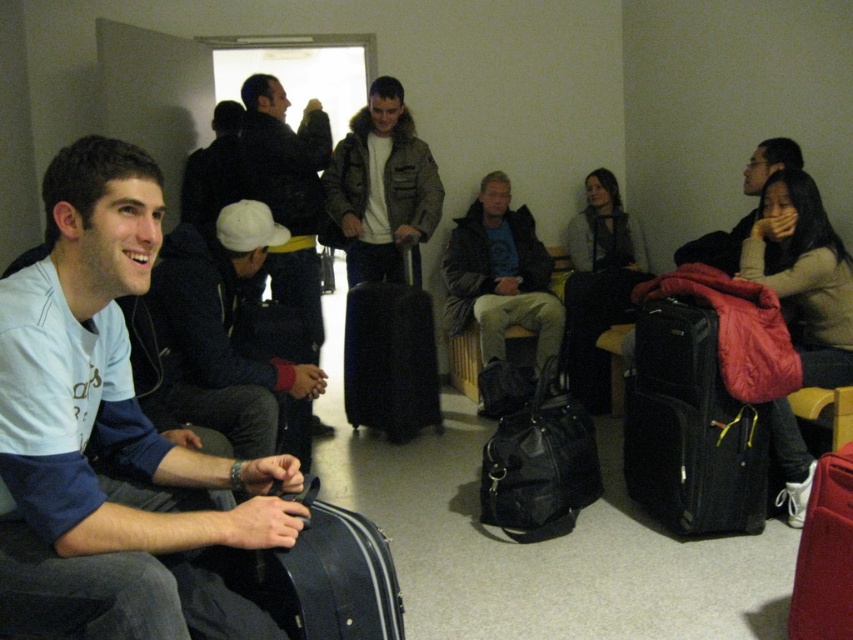
You are standing in the waiting area and need to place a camera on a shelf that can only hold items up to 7 feet away from the light blue fleece at left. Can you place the camera there?

The light blue fleece at left and camera are 7.34 feet apart, which exceeds the shelf limit of 7 feet. Therefore, the camera cannot be placed there.

You are a traveler trying to decide between two items to take with you. You see a light blue fleece at left and a matte black jacket at lower right. Which one is bigger in size?

The light blue fleece at left is larger in size compared to the matte black jacket at lower right.

You are a delivery robot with a package that needs to be placed between the light blue fleece at left and the matte black jacket at lower right. The package requires at least 1.5 meters of space. Can you fit it there?

The light blue fleece at left and matte black jacket at lower right are 1.74 meters apart from each other, so yes, the package can be placed there as the distance is sufficient.